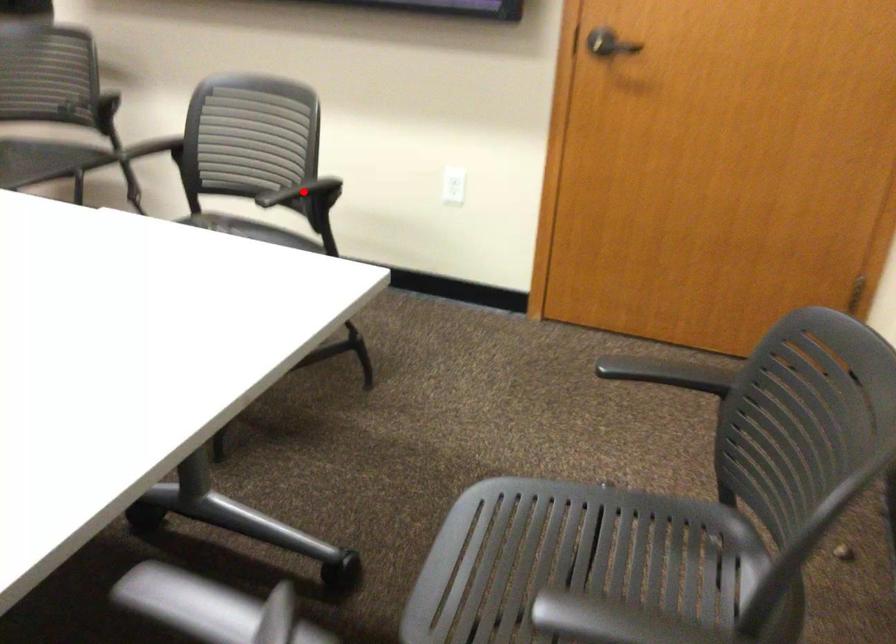
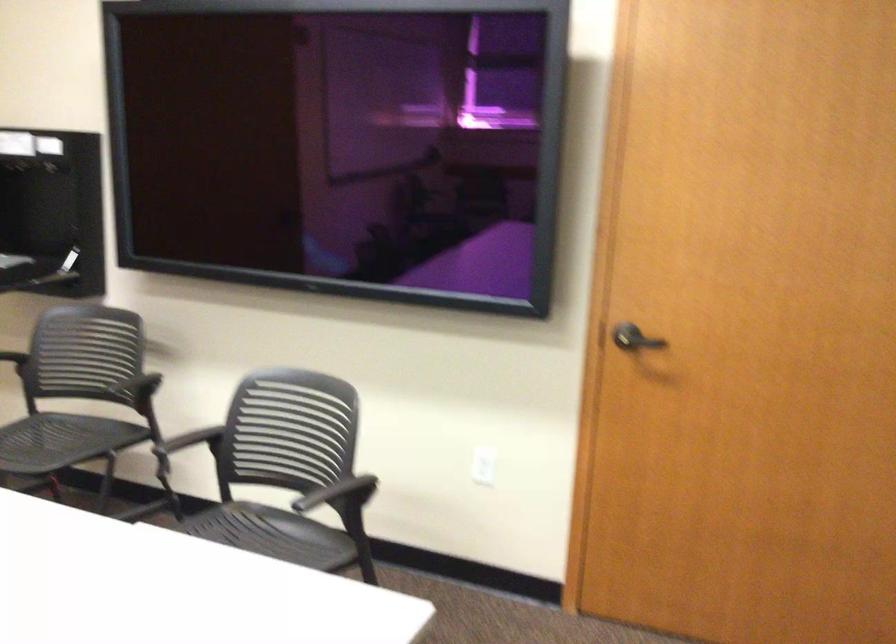
The point at the highlighted location is marked in the first image. Where is the corresponding point in the second image?

(337, 493)